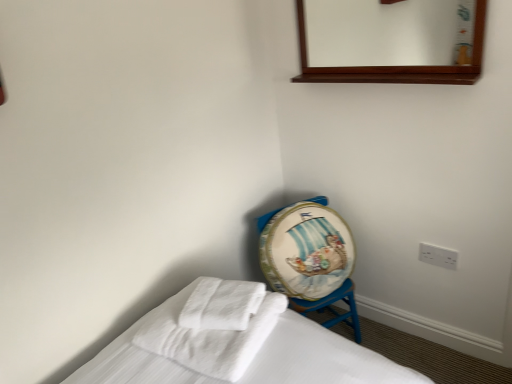
Question: Would you say white plastic electric outlet at lower right is part of painted wood drum at lower right's contents?

Choices:
 (A) yes
 (B) no

Answer: (B)

Question: Does painted wood drum at lower right have a greater width compared to white plastic electric outlet at lower right?

Choices:
 (A) yes
 (B) no

Answer: (A)

Question: Does painted wood drum at lower right lie in front of white plastic electric outlet at lower right?

Choices:
 (A) no
 (B) yes

Answer: (B)

Question: Can you confirm if painted wood drum at lower right is shorter than white plastic electric outlet at lower right?

Choices:
 (A) no
 (B) yes

Answer: (A)

Question: Is painted wood drum at lower right to the right of white plastic electric outlet at lower right from the viewer's perspective?

Choices:
 (A) yes
 (B) no

Answer: (B)

Question: Does painted wood drum at lower right have a greater height compared to white plastic electric outlet at lower right?

Choices:
 (A) yes
 (B) no

Answer: (A)

Question: From the image's perspective, is painted wood drum at lower right above white soft towel at center, the second bath towel from the left?

Choices:
 (A) yes
 (B) no

Answer: (B)

Question: Can you confirm if painted wood drum at lower right is shorter than white soft towel at center, the 1th bath towel from the right?

Choices:
 (A) no
 (B) yes

Answer: (A)

Question: From a real-world perspective, is painted wood drum at lower right over white soft towel at center, the second bath towel from the left?

Choices:
 (A) yes
 (B) no

Answer: (B)

Question: From a real-world perspective, is painted wood drum at lower right below white soft towel at center, the 1th bath towel from the right?

Choices:
 (A) yes
 (B) no

Answer: (A)

Question: Considering the relative positions of painted wood drum at lower right and white soft towel at center, the 1th bath towel from the right, in the image provided, is painted wood drum at lower right to the right of white soft towel at center, the 1th bath towel from the right, from the viewer's perspective?

Choices:
 (A) yes
 (B) no

Answer: (A)

Question: Is white soft towel at center, the second bath towel from the left, inside painted wood drum at lower right?

Choices:
 (A) yes
 (B) no

Answer: (B)

Question: Is white soft towel at lower left, the 1th bath towel in the left-to-right sequence, positioned beyond the bounds of wooden mirror at upper center?

Choices:
 (A) no
 (B) yes

Answer: (B)